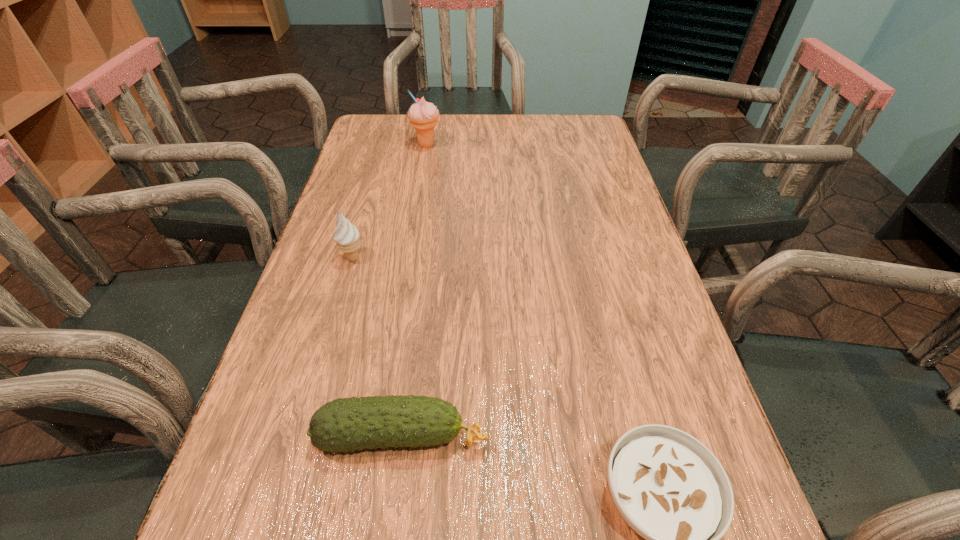
Find the location of `cucumber situated at the left edge`. cucumber situated at the left edge is located at coordinates (349, 424).

The height and width of the screenshot is (540, 960). Identify the location of free space at the far edge. (530, 126).

The height and width of the screenshot is (540, 960). Find the location of `vacant space at the left edge of the desktop`. vacant space at the left edge of the desktop is located at coordinates (395, 188).

Locate an element on the screen. The image size is (960, 540). vacant space at the right edge of the desktop is located at coordinates (609, 157).

Identify the location of blank space at the far left corner of the desktop. (361, 127).

Locate an element on the screen. This screenshot has height=540, width=960. vacant space at the far right corner of the desktop is located at coordinates (582, 115).

The image size is (960, 540). Identify the location of unoccupied position between the farther icecream and the cucumber. (415, 291).

Find the location of a particular element. The height and width of the screenshot is (540, 960). free spot between the third nearest object and the cucumber is located at coordinates (377, 347).

This screenshot has height=540, width=960. I want to click on vacant area that lies between the shorter icecream and the farther icecream, so click(390, 201).

Identify which object is the second closest to the soup bowl. Please provide its 2D coordinates. Your answer should be formatted as a tuple, i.e. [(x, y)], where the tuple contains the x and y coordinates of a point satisfying the conditions above.

[(347, 235)]